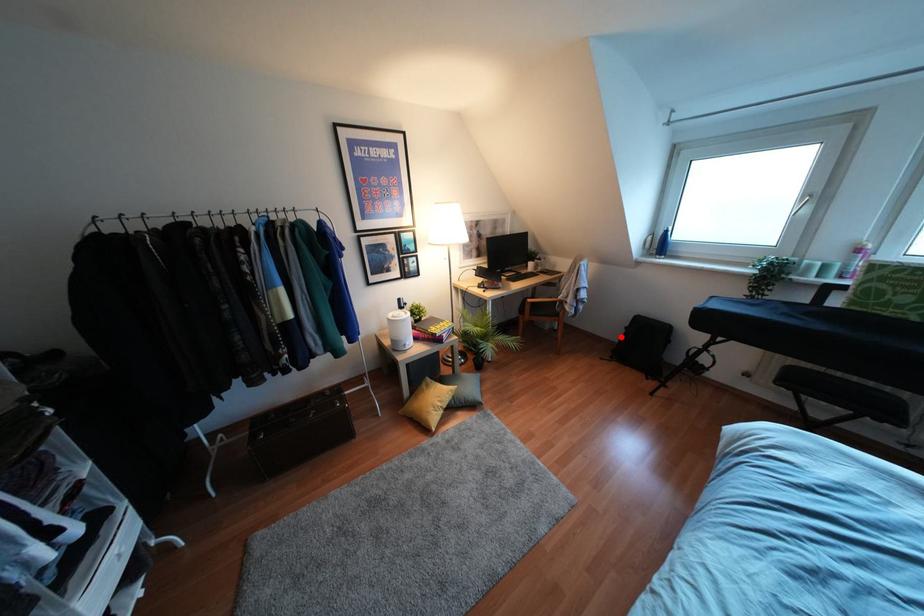
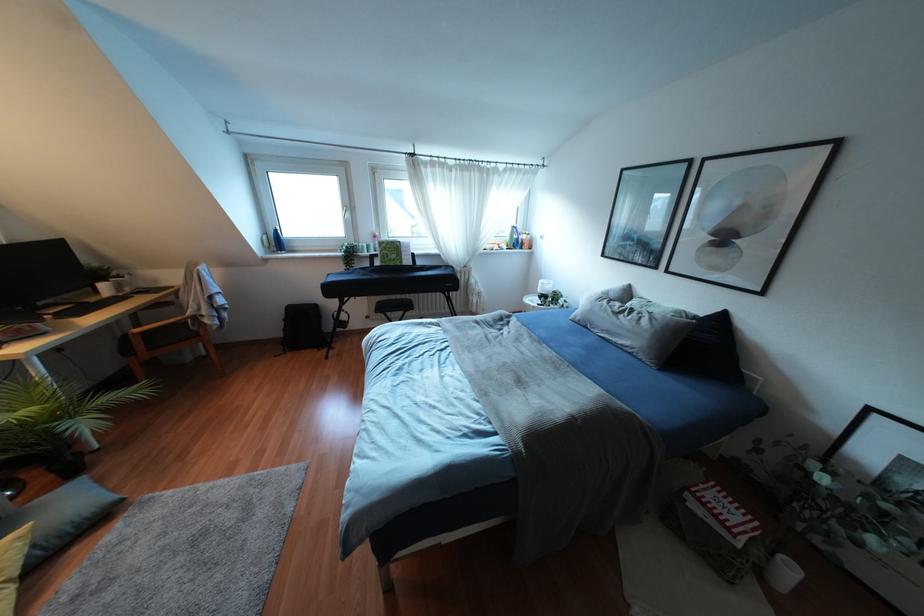
In the second image, find the point that corresponds to the highlighted location in the first image.

(284, 329)